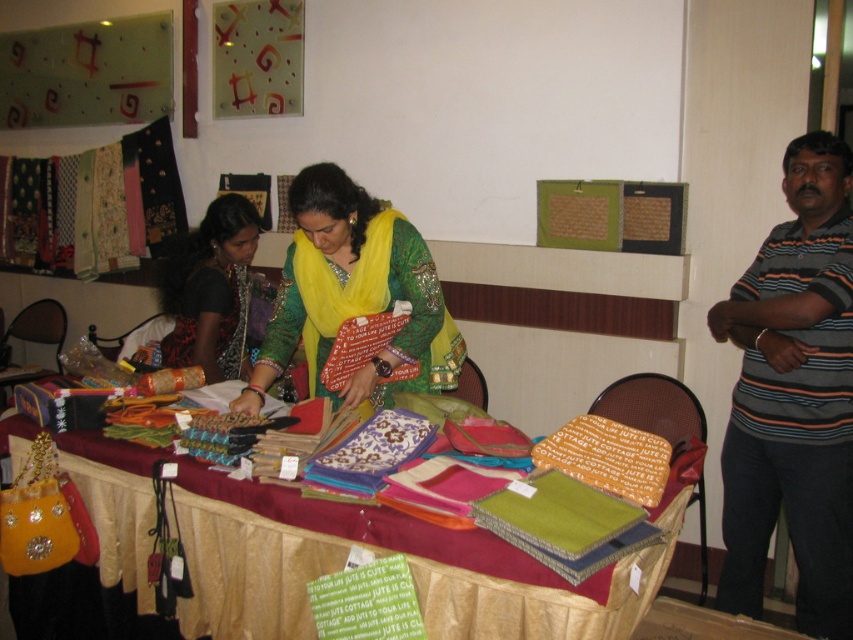
Question: Can you confirm if textured fabric at center is smaller than striped cotton shirt at right?

Choices:
 (A) yes
 (B) no

Answer: (B)

Question: Which of the following is the closest to the observer?

Choices:
 (A) 236,216
 (B) 152,141
 (C) 848,508
 (D) 144,520

Answer: (D)

Question: Which is farther from the striped cotton shirt at right?

Choices:
 (A) textured fabric at center
 (B) black woven fabric at upper left

Answer: (B)

Question: Which point is closer to the camera?

Choices:
 (A) matte orange fabric at center
 (B) textured fabric at center
 (C) black woven fabric at upper left
 (D) striped cotton shirt at right

Answer: (B)

Question: Is textured fabric at center above matte black blouse at center?

Choices:
 (A) no
 (B) yes

Answer: (A)

Question: Does black woven fabric at upper left come behind matte orange fabric at center?

Choices:
 (A) yes
 (B) no

Answer: (A)